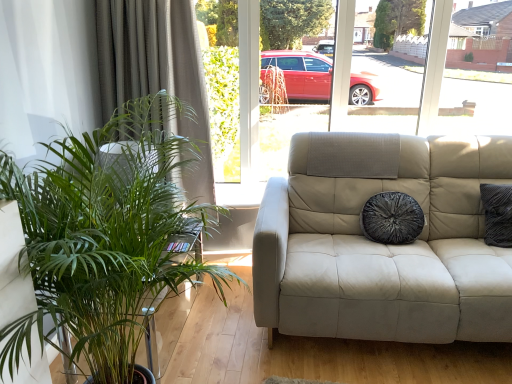
Question: Is green leafy plant at left wider than velvety black pillow at center?

Choices:
 (A) no
 (B) yes

Answer: (B)

Question: Considering the relative sizes of green leafy plant at left and velvety black pillow at center in the image provided, is green leafy plant at left thinner than velvety black pillow at center?

Choices:
 (A) no
 (B) yes

Answer: (A)

Question: Is green leafy plant at left smaller than velvety black pillow at center?

Choices:
 (A) yes
 (B) no

Answer: (B)

Question: Is the surface of green leafy plant at left in direct contact with velvety black pillow at center?

Choices:
 (A) no
 (B) yes

Answer: (A)

Question: Is green leafy plant at left facing towards velvety black pillow at center?

Choices:
 (A) no
 (B) yes

Answer: (B)

Question: Would you consider green leafy plant at left to be distant from velvety black pillow at center?

Choices:
 (A) yes
 (B) no

Answer: (A)

Question: Does green leafy plant at left have a larger size compared to green fabric curtain at left?

Choices:
 (A) no
 (B) yes

Answer: (B)

Question: Is green leafy plant at left smaller than green fabric curtain at left?

Choices:
 (A) no
 (B) yes

Answer: (A)

Question: Does green leafy plant at left turn towards green fabric curtain at left?

Choices:
 (A) no
 (B) yes

Answer: (A)

Question: From the image's perspective, would you say green leafy plant at left is positioned over green fabric curtain at left?

Choices:
 (A) no
 (B) yes

Answer: (A)

Question: Does green leafy plant at left lie behind green fabric curtain at left?

Choices:
 (A) yes
 (B) no

Answer: (B)

Question: Is green fabric curtain at left inside green leafy plant at left?

Choices:
 (A) no
 (B) yes

Answer: (A)

Question: From the image's perspective, is velvety black pillow at center beneath green fabric curtain at left?

Choices:
 (A) yes
 (B) no

Answer: (A)